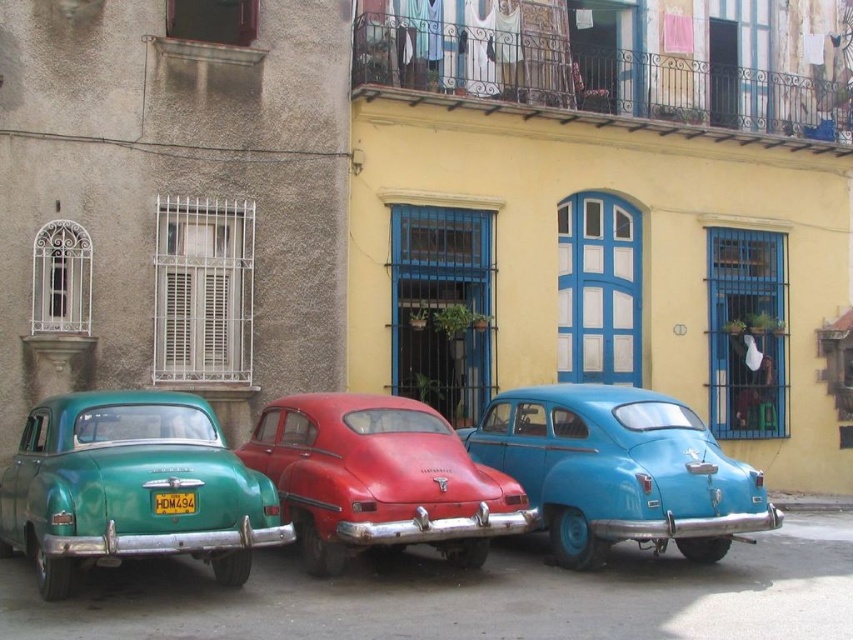
Consider the image. You are a photographer standing in front of the three vintage cars. You want to take a photo that includes both the teal glossy sedan at left and the rusty red car at center. Which car should you move closer to in order to have both cars clearly visible in your shot?

You should move closer to the teal glossy sedan at left because it is already closer to the viewer than the rusty red car at center, so adjusting your position towards it will help frame both cars better in the photo.

You are a delivery person trying to park a new car that is 1.8 meters wide between the teal glossy sedan at left and the rusty red car at center. Can you fit your car in the space between them based on their widths?

The teal glossy sedan at left is narrower than the rusty red car at center. However, the width of the space between them depends on their positions, not just their widths. Since the description only states their widths and not the distance between them, it is impossible to determine if the 1.8 meter wide car can fit.